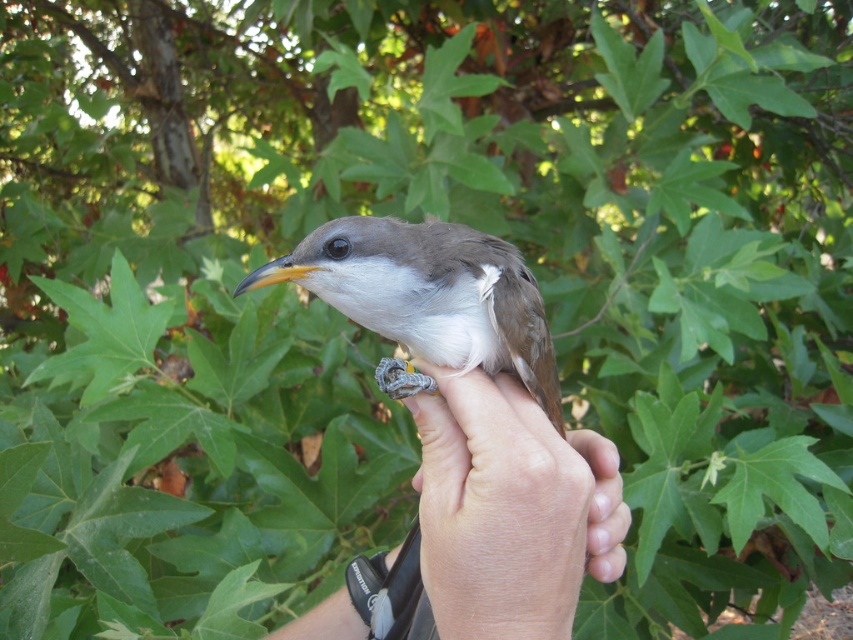
What are the coordinates of the smooth skin hand at center?

The smooth skin hand at center is located at point (x=509, y=509).

You are a photographer trying to capture the bird and the hand in the scene. Since the smooth skin hand at center and the brown matte bird at center are both important subjects, which one should you focus on first if you want to ensure both are in focus?

The smooth skin hand at center is positioned on the right side of brown matte bird at center, so you should focus on the brown matte bird at center first to ensure both are in focus since focusing on the closer subject first allows for better depth of field coverage.

You are a photographer trying to capture a close shot of the bird. You need to adjust your focus so that the brown matte bird at center is in focus while the smooth skin hand at center is slightly blurred. Based on their positions, which object should you focus on and why?

You should focus on the brown matte bird at center because it is positioned above the smooth skin hand at center. By focusing on the bird, the hand will naturally be slightly out of focus due to its lower position relative to the bird.